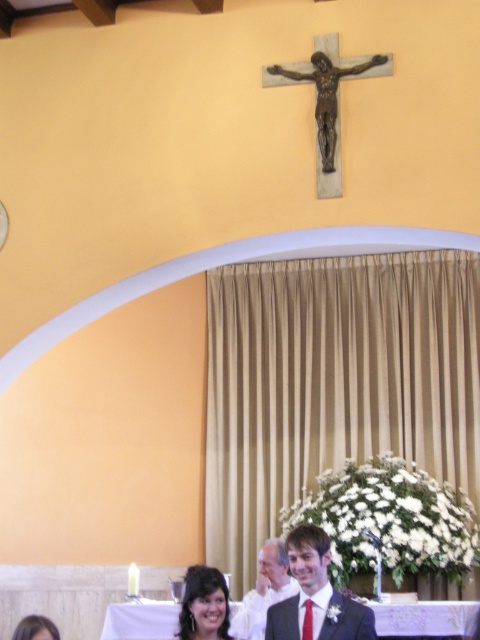
Question: In this image, where is matte black suit at center located relative to matte black suit at lower center?

Choices:
 (A) below
 (B) above

Answer: (B)

Question: Which of the following is the farthest from the observer?

Choices:
 (A) (192, 580)
 (B) (240, 604)
 (C) (275, 620)

Answer: (B)

Question: Which point is farther to the camera?

Choices:
 (A) (308, 612)
 (B) (250, 612)
 (C) (191, 588)

Answer: (B)

Question: Does matte black suit at center have a greater width compared to matte black hair at lower center?

Choices:
 (A) yes
 (B) no

Answer: (A)

Question: Estimate the real-world distances between objects in this image. Which object is closer to the matte black hair at lower center?

Choices:
 (A) matte black suit at center
 (B) matte black suit at lower center

Answer: (A)

Question: Is matte black suit at center to the left of matte black suit at lower center from the viewer's perspective?

Choices:
 (A) no
 (B) yes

Answer: (A)